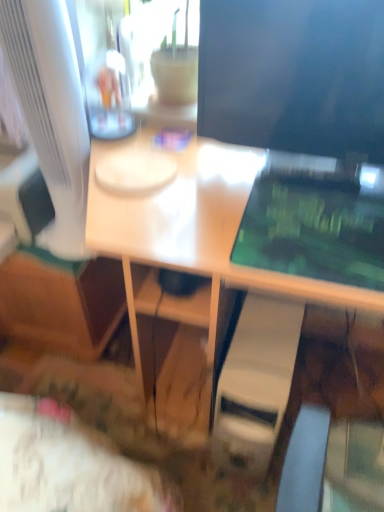
Locate an element on the screen. vacant region to the left of matte black monitor at upper right, which appears as the first computer monitor when viewed from the right is located at coordinates (192, 190).